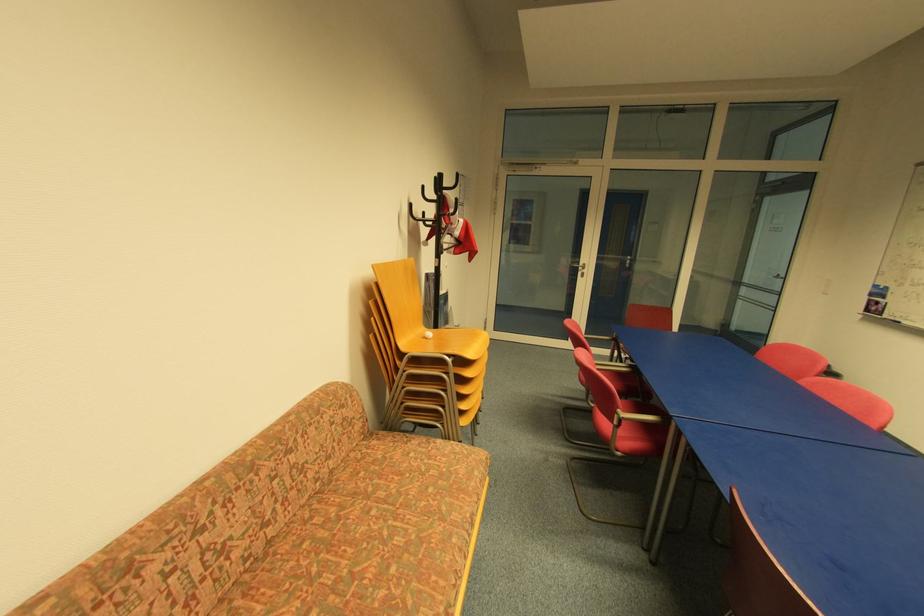
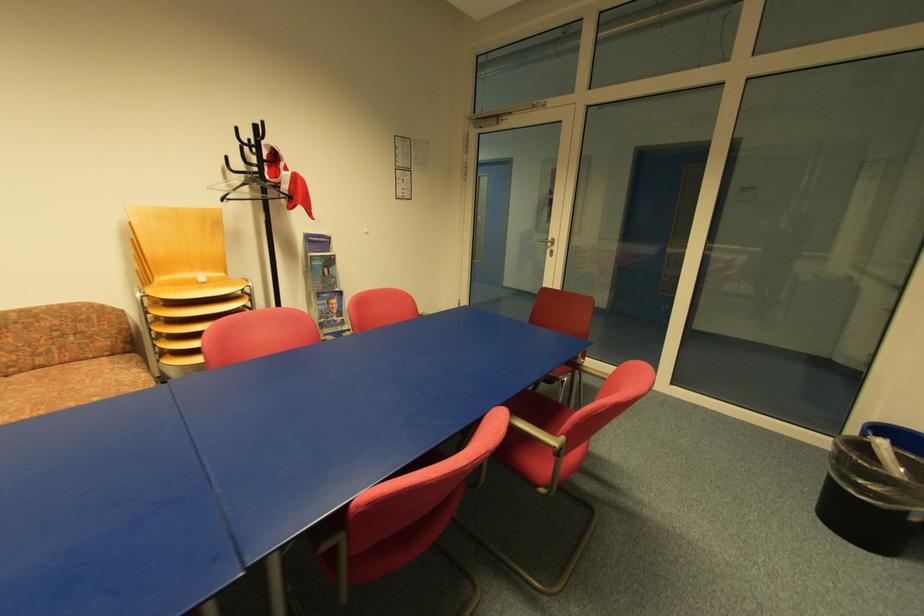
Find the pixel in the second image that matches (x=460, y=238) in the first image.

(292, 193)